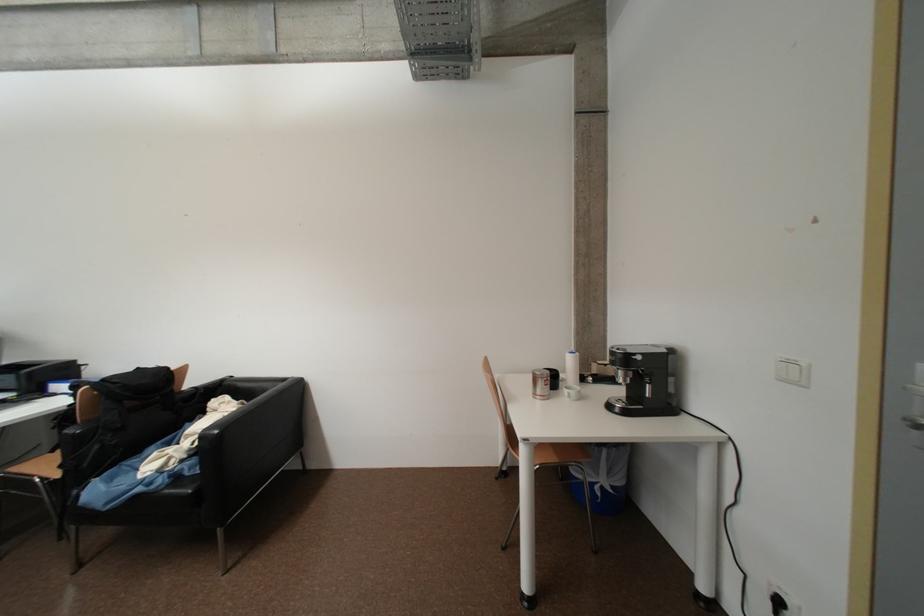
Where would you pull the coffee machine handle? Please return your answer as a coordinate pair (x, y).

(652, 392)